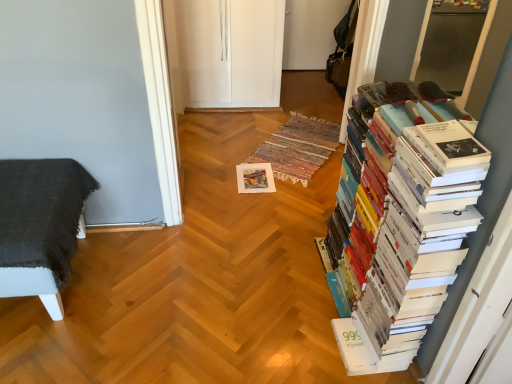
What do you see at coordinates (404, 227) in the screenshot? This screenshot has width=512, height=384. I see `white paper book at right` at bounding box center [404, 227].

What do you see at coordinates (255, 178) in the screenshot? I see `white paper at center` at bounding box center [255, 178].

The image size is (512, 384). I want to click on dark gray woven blanket on the left, so click(x=40, y=225).

Identify the location of book that is above the dark gray woven blanket on the left (from a real-world perspective). This screenshot has height=384, width=512. tap(404, 227).

From a real-world perspective, is white paper book at right over dark gray woven blanket on the left?

Yes.

Is white paper book at right aimed at dark gray woven blanket on the left?

Yes, white paper book at right is aimed at dark gray woven blanket on the left.

Measure the distance from dark gray woven blanket on the left to white paper book at right.

dark gray woven blanket on the left is 3.84 feet from white paper book at right.

Can you confirm if dark gray woven blanket on the left is smaller than white paper book at right?

Correct, dark gray woven blanket on the left occupies less space than white paper book at right.

Does dark gray woven blanket on the left touch white paper book at right?

There is a gap between dark gray woven blanket on the left and white paper book at right.

In the scene shown: From the image's perspective, who appears lower, dark gray woven blanket on the left or white paper book at right?

From the image's view, dark gray woven blanket on the left is below.

Considering the sizes of white paper book at right and white paper at center in the image, is white paper book at right taller or shorter than white paper at center?

Clearly, white paper book at right is taller compared to white paper at center.

Is white paper book at right in front of or behind white paper at center in the image?

In the image, white paper book at right appears in front of white paper at center.

The width and height of the screenshot is (512, 384). What are the coordinates of `book on the right of white paper at center` in the screenshot? It's located at (x=404, y=227).

Who is shorter, white paper at center or dark gray woven blanket on the left?

Standing shorter between the two is white paper at center.

Is there a large distance between white paper at center and dark gray woven blanket on the left?

Yes.

From the image's perspective, does white paper at center appear higher than dark gray woven blanket on the left?

Yes.

How many degrees apart are the facing directions of white paper at center and dark gray woven blanket on the left?

They differ by 4.37 degrees in their facing directions.

From the image's perspective, would you say white paper at center is positioned over white paper book at right?

Yes.

Is white paper at center facing away from white paper book at right?

No, white paper at center is not facing the opposite direction of white paper book at right.

From a real-world perspective, is white paper at center positioned under white paper book at right based on gravity?

Yes, from a real-world perspective, white paper at center is below white paper book at right.

How many degrees apart are the facing directions of white paper at center and white paper book at right?

white paper at center and white paper book at right are facing 84.5 degrees away from each other.

At what (x,y) coordinates should I click in order to perform the action: click on furniture below the white paper at center (from the image's perspective). Please return your answer as a coordinate pair (x, y). The height and width of the screenshot is (384, 512). Looking at the image, I should click on (40, 225).

Would you say dark gray woven blanket on the left is outside white paper at center?

That's correct, dark gray woven blanket on the left is outside of white paper at center.

Does point (25, 254) come behind point (265, 178)?

No, (25, 254) is closer to viewer.

Considering the positions of objects dark gray woven blanket on the left and white paper at center in the image provided, who is more to the right, dark gray woven blanket on the left or white paper at center?

Positioned to the right is white paper at center.

Identify the location of furniture that appears below the white paper book at right (from a real-world perspective). The width and height of the screenshot is (512, 384). (40, 225).

Where is `book that appears in front of the dark gray woven blanket on the left`? Image resolution: width=512 pixels, height=384 pixels. book that appears in front of the dark gray woven blanket on the left is located at coordinates (404, 227).

Looking at the image, which one is located further to dark gray woven blanket on the left, white paper book at right or white paper at center?

Based on the image, white paper book at right appears to be further to dark gray woven blanket on the left.

Based on their spatial positions, is white paper book at right or dark gray woven blanket on the left closer to white paper at center?

The object closer to white paper at center is dark gray woven blanket on the left.

Looking at the image, which one is located closer to white paper book at right, white paper at center or dark gray woven blanket on the left?

Based on the image, white paper at center appears to be nearer to white paper book at right.

Considering their positions, is white paper at center positioned closer to dark gray woven blanket on the left than white paper book at right?

white paper at center.

Consider the image. From the image, which object appears to be farther from white paper book at right, dark gray woven blanket on the left or white paper at center?

dark gray woven blanket on the left is further to white paper book at right.

Considering their positions, is dark gray woven blanket on the left positioned further to white paper at center than white paper book at right?

white paper book at right is positioned further to the anchor white paper at center.

Find the location of a particular element. furniture between white paper book at right and white paper at center in the front-back direction is located at coordinates (40, 225).